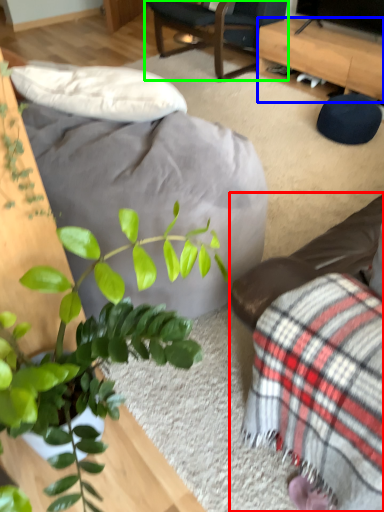
Question: Which object is positioned farthest from studio couch (highlighted by a red box)? Select from desk (highlighted by a blue box) and chair (highlighted by a green box).

Choices:
 (A) desk
 (B) chair

Answer: (B)